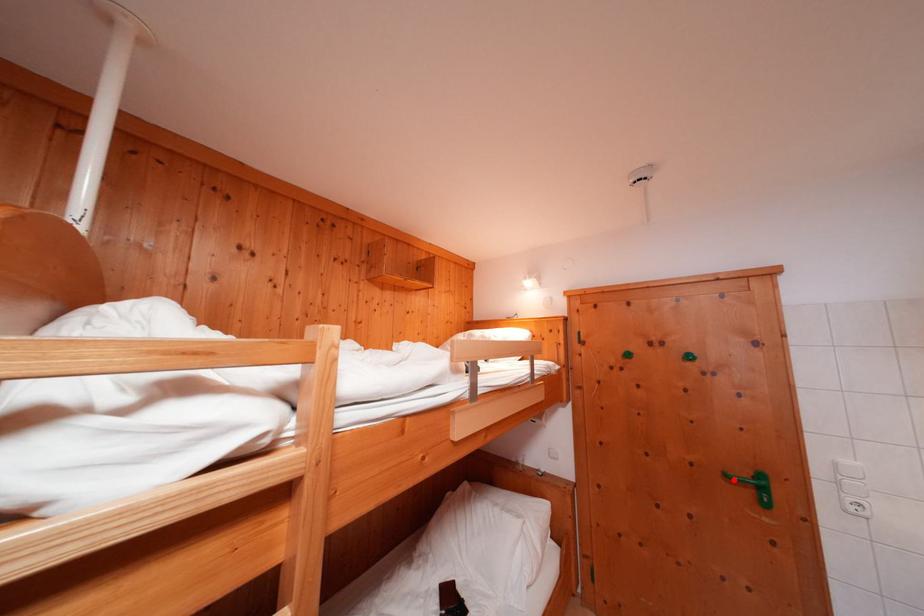
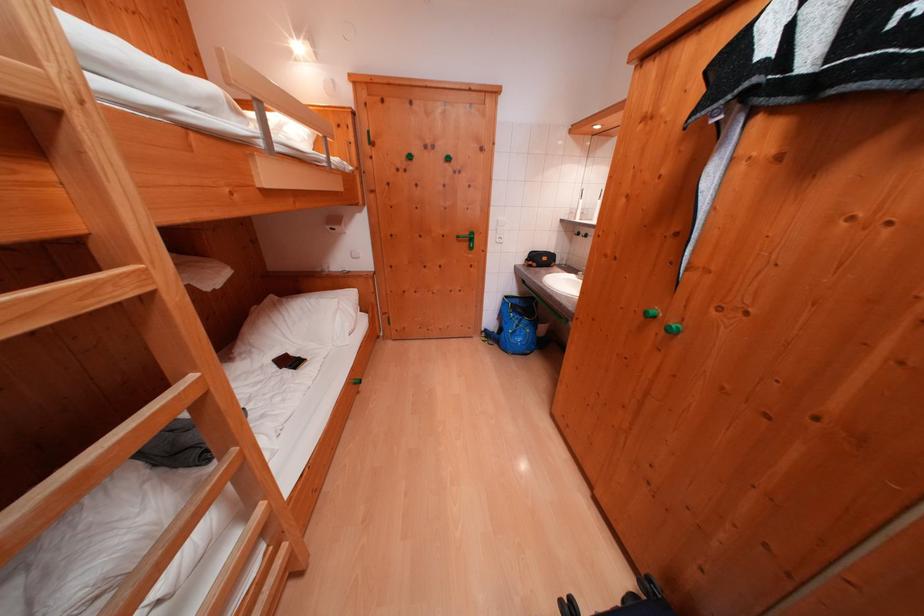
Where in the second image is the point corresponding to the highlighted location from the first image?

(466, 241)